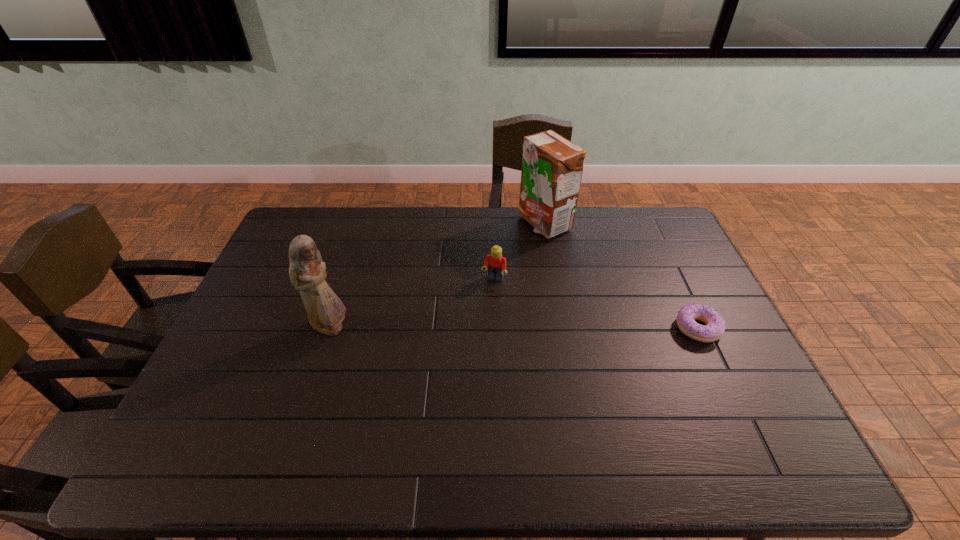
In the image, there is a desktop. At what (x,y) coordinates should I click in order to perform the action: click on vacant space at the far left corner. Please return your answer as a coordinate pair (x, y). Looking at the image, I should click on (319, 246).

Identify the location of blank area at the far right corner. The width and height of the screenshot is (960, 540). (632, 221).

Identify the location of free space between the second object from left to right and the leftmost object. (412, 304).

The height and width of the screenshot is (540, 960). In order to click on unoccupied area between the doughnut and the second object from right to left in this screenshot , I will do `click(621, 276)`.

You are a GUI agent. You are given a task and a screenshot of the screen. Output one action in this format:
    pyautogui.click(x=<x>, y=<y>)
    Task: Click on the unoccupied position between the shortest object and the third tallest object
    
    Given the screenshot: What is the action you would take?
    pyautogui.click(x=596, y=304)

Where is `vacant point located between the rightmost object and the second farthest object`? vacant point located between the rightmost object and the second farthest object is located at coordinates click(x=596, y=304).

This screenshot has height=540, width=960. Identify the location of unoccupied position between the shortest object and the second object from left to right. (596, 304).

This screenshot has height=540, width=960. What are the coordinates of `free area in between the figurine and the third nearest object` in the screenshot? It's located at (412, 304).

Find the location of a particular element. This screenshot has width=960, height=540. free space between the shortest object and the farthest object is located at coordinates (621, 276).

This screenshot has height=540, width=960. What are the coordinates of `free space between the third tallest object and the second object from right to left` in the screenshot? It's located at (518, 252).